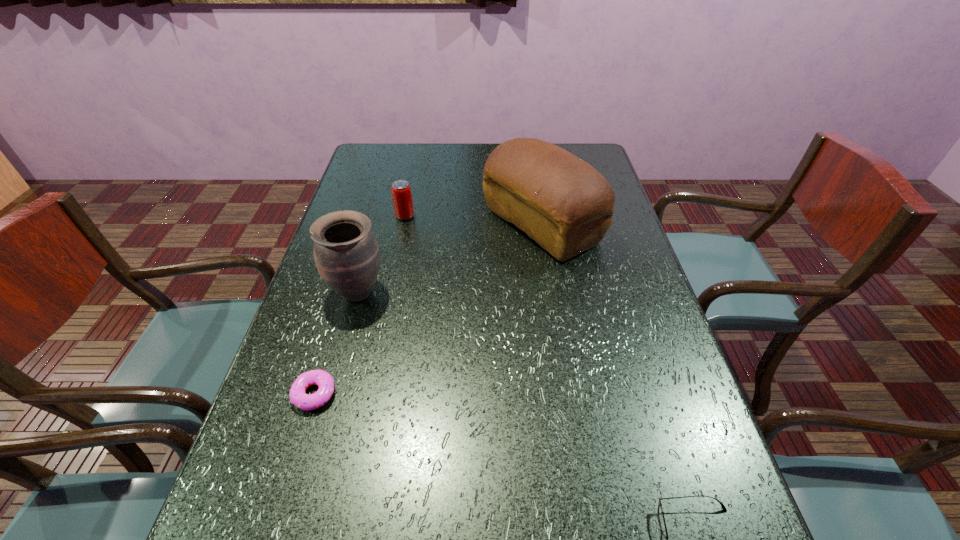
This screenshot has width=960, height=540. I want to click on object located at the right edge, so click(560, 201).

Where is `vacant space at the far edge of the desktop`? Image resolution: width=960 pixels, height=540 pixels. vacant space at the far edge of the desktop is located at coordinates (456, 143).

In the image, there is a desktop. Find the location of `blank space at the left edge`. blank space at the left edge is located at coordinates (346, 309).

Find the location of a particular element. This screenshot has width=960, height=540. free spot at the right edge of the desktop is located at coordinates (699, 485).

Locate an element on the screen. The height and width of the screenshot is (540, 960). free space at the far left corner is located at coordinates click(x=376, y=147).

Where is `unoccupied position between the third farthest object and the doughnut`? unoccupied position between the third farthest object and the doughnut is located at coordinates (336, 343).

Identify the location of empty space that is in between the bread and the doughnut. The image size is (960, 540). (428, 309).

Identify the location of free spot between the doughnut and the third nearest object. (336, 343).

Locate an element on the screen. Image resolution: width=960 pixels, height=540 pixels. free area in between the bread and the doughnut is located at coordinates (428, 309).

The width and height of the screenshot is (960, 540). I want to click on vacant region between the bread and the urn, so tap(449, 259).